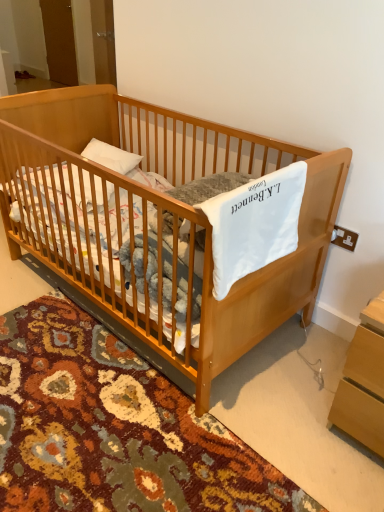
Question: Is light brown wooden changing table at lower right looking in the opposite direction of light brown wooden crib at center?

Choices:
 (A) no
 (B) yes

Answer: (A)

Question: Is light brown wooden changing table at lower right thinner than light brown wooden crib at center?

Choices:
 (A) yes
 (B) no

Answer: (A)

Question: Can you confirm if light brown wooden changing table at lower right is bigger than light brown wooden crib at center?

Choices:
 (A) yes
 (B) no

Answer: (B)

Question: Does light brown wooden changing table at lower right have a greater width compared to light brown wooden crib at center?

Choices:
 (A) no
 (B) yes

Answer: (A)

Question: Is light brown wooden crib at center completely or partially inside light brown wooden changing table at lower right?

Choices:
 (A) no
 (B) yes

Answer: (A)

Question: Can you confirm if light brown wooden changing table at lower right is taller than light brown wooden crib at center?

Choices:
 (A) yes
 (B) no

Answer: (B)

Question: From a real-world perspective, is light brown wooden changing table at lower right positioned under white soft blanket at center based on gravity?

Choices:
 (A) no
 (B) yes

Answer: (B)

Question: Is light brown wooden changing table at lower right far away from white soft blanket at center?

Choices:
 (A) no
 (B) yes

Answer: (A)

Question: Is white soft blanket at center a part of light brown wooden changing table at lower right?

Choices:
 (A) yes
 (B) no

Answer: (B)

Question: Can you confirm if light brown wooden changing table at lower right is wider than white soft blanket at center?

Choices:
 (A) no
 (B) yes

Answer: (B)

Question: Is light brown wooden changing table at lower right positioned beyond the bounds of white soft blanket at center?

Choices:
 (A) no
 (B) yes

Answer: (B)

Question: Is light brown wooden changing table at lower right to the left of white soft blanket at center from the viewer's perspective?

Choices:
 (A) yes
 (B) no

Answer: (B)

Question: From the image's perspective, is light brown wooden crib at center over white soft blanket at center?

Choices:
 (A) no
 (B) yes

Answer: (B)